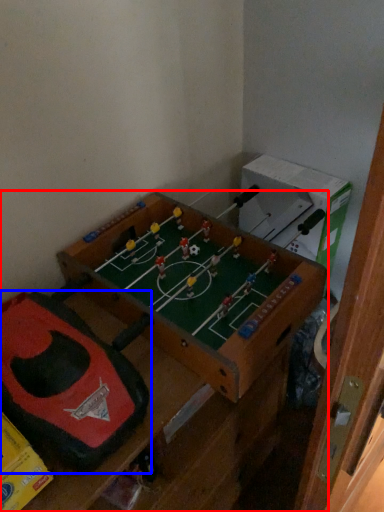
Question: Which object appears closest to the camera in this image, furniture (highlighted by a red box) or toy (highlighted by a blue box)?

Choices:
 (A) furniture
 (B) toy

Answer: (A)